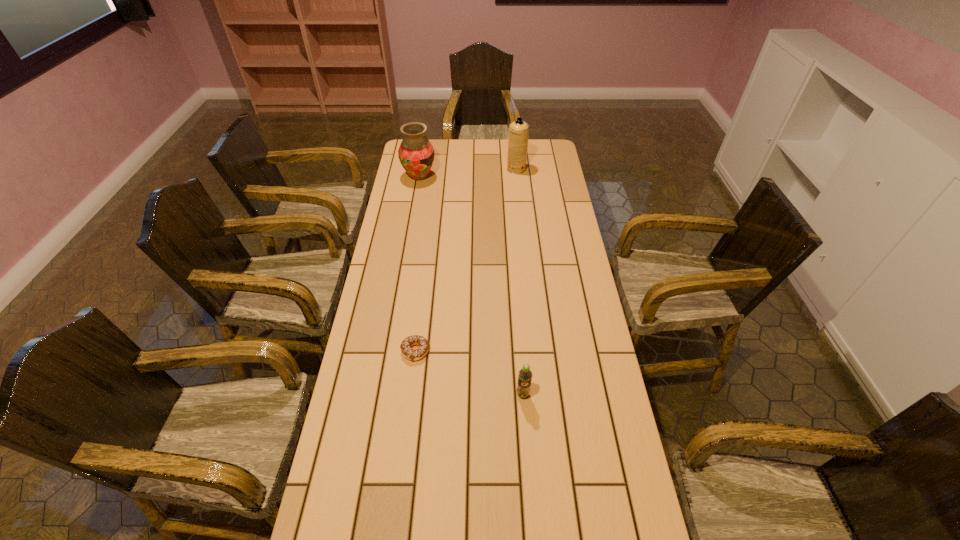
Locate which object ranks second in proximity to the doughnut. Please provide its 2D coordinates. Your answer should be formatted as a tuple, i.e. [(x, y)], where the tuple contains the x and y coordinates of a point satisfying the conditions above.

[(416, 154)]

Locate an element on the screen. vacant space that satisfies the following two spatial constraints: 1. on the front side of the shortest object; 2. on the right side of the vase is located at coordinates (390, 351).

At what (x,y) coordinates should I click in order to perform the action: click on blank area in the image that satisfies the following two spatial constraints: 1. on the front side of the vase; 2. on the right side of the shortest object. Please return your answer as a coordinate pair (x, y). Image resolution: width=960 pixels, height=540 pixels. Looking at the image, I should click on (390, 351).

This screenshot has height=540, width=960. Find the location of `vacant space that satisfies the following two spatial constraints: 1. on the back side of the third farthest object; 2. on the right side of the aerosol can`. vacant space that satisfies the following two spatial constraints: 1. on the back side of the third farthest object; 2. on the right side of the aerosol can is located at coordinates (438, 169).

Locate an element on the screen. Image resolution: width=960 pixels, height=540 pixels. vacant space that satisfies the following two spatial constraints: 1. on the front side of the second nearest object; 2. on the left side of the vase is located at coordinates (390, 351).